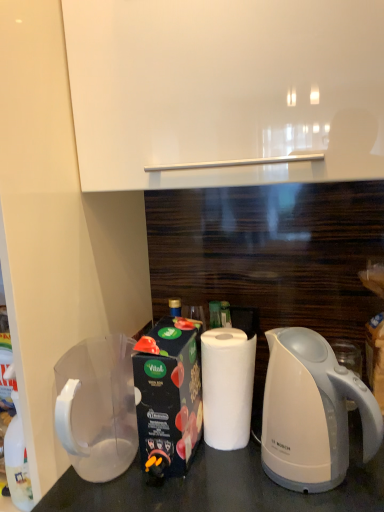
Question: Considering the positions of white matte paper towel at center and transparent plastic pitcher at lower left in the image, is white matte paper towel at center taller or shorter than transparent plastic pitcher at lower left?

Choices:
 (A) tall
 (B) short

Answer: (A)

Question: Is white matte paper towel at center wider or thinner than transparent plastic pitcher at lower left?

Choices:
 (A) wide
 (B) thin

Answer: (B)

Question: Which is nearer to the transparent plastic pitcher at lower left?

Choices:
 (A) white matte paper towel at center
 (B) white glossy electric kettle at lower right

Answer: (A)

Question: Estimate the real-world distances between objects in this image. Which object is farther from the white glossy electric kettle at lower right?

Choices:
 (A) transparent plastic pitcher at lower left
 (B) white matte paper towel at center

Answer: (A)